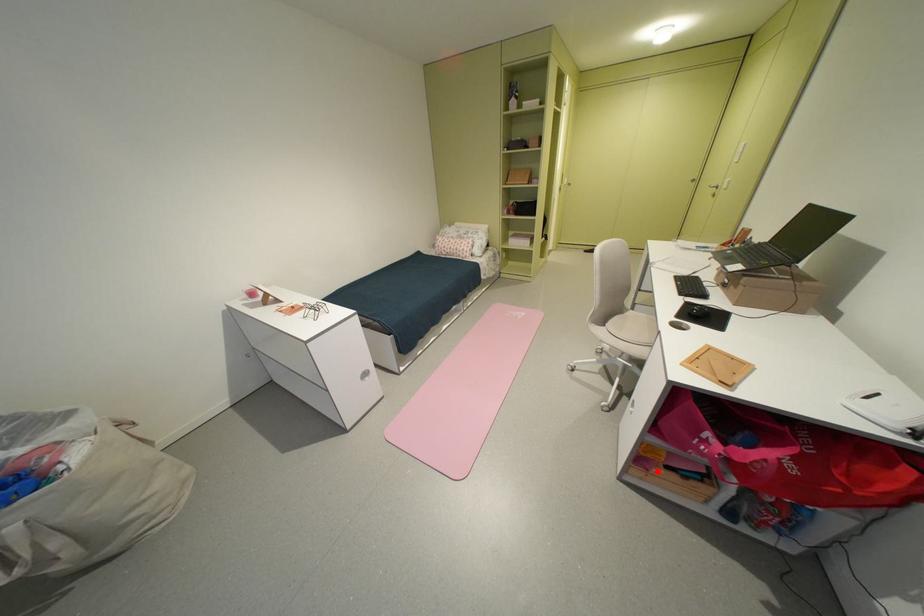
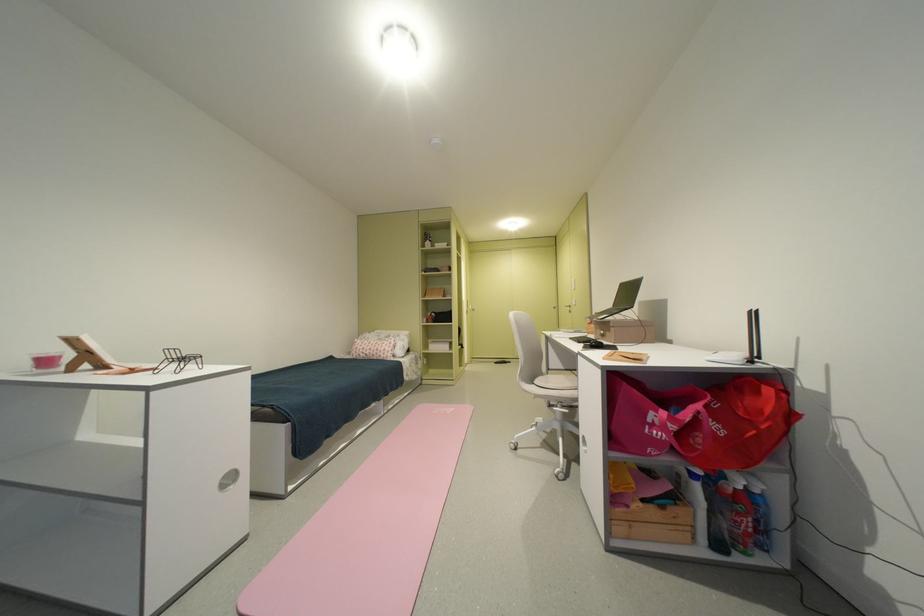
Locate, in the second image, the point that corresponds to the highlighted location in the first image.

(638, 508)